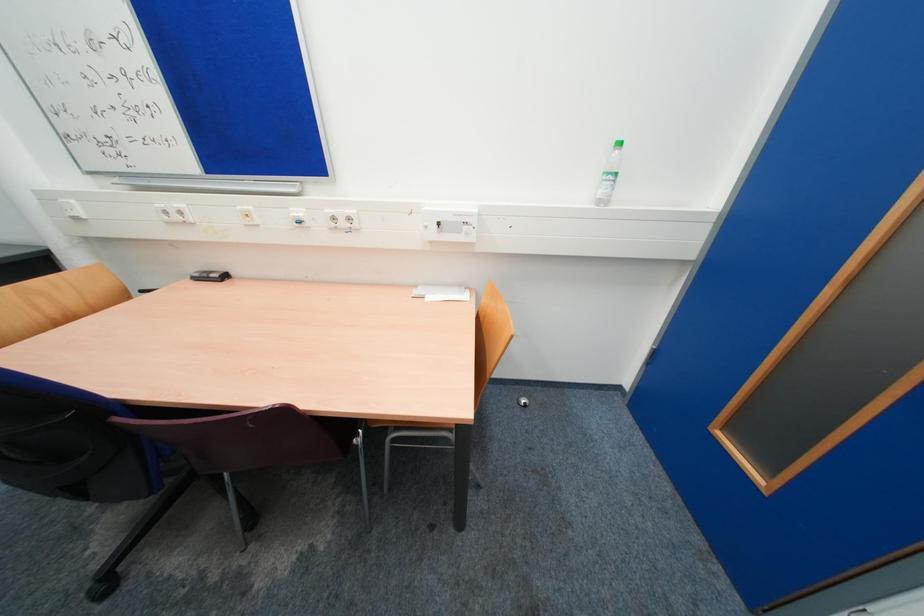
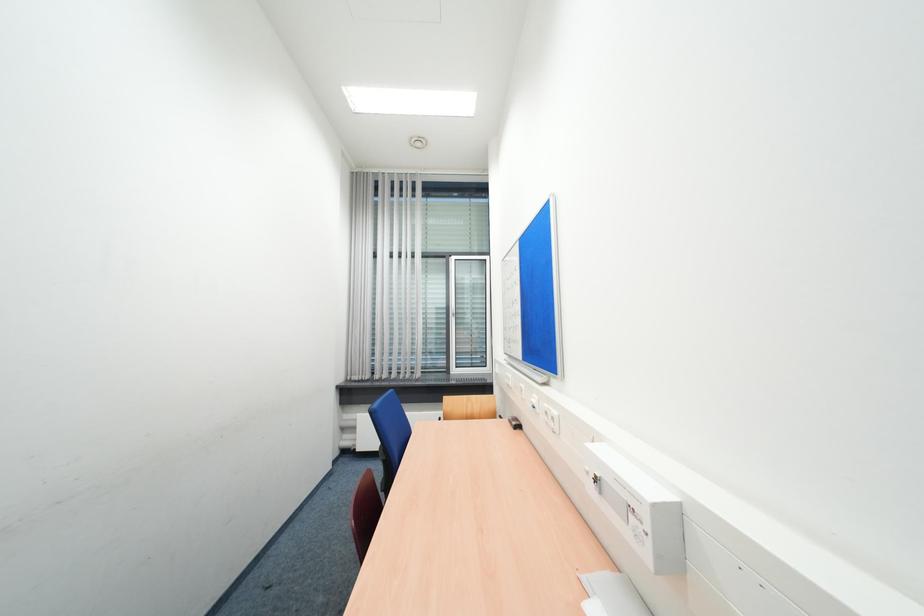
Question: How did the camera likely rotate?

Choices:
 (A) Left
 (B) Right
 (C) Up
 (D) Down

Answer: (A)